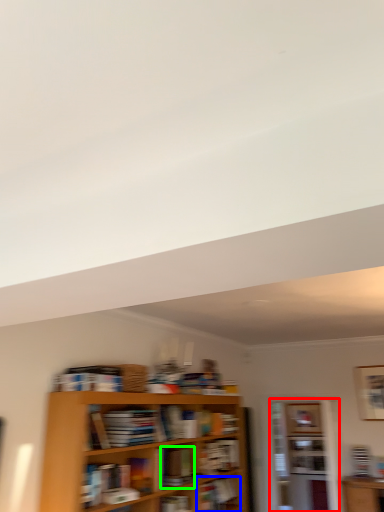
Question: Considering the real-world distances, which object is closest to shelf (highlighted by a red box)? book (highlighted by a blue box) or book (highlighted by a green box).

Choices:
 (A) book
 (B) book

Answer: (A)